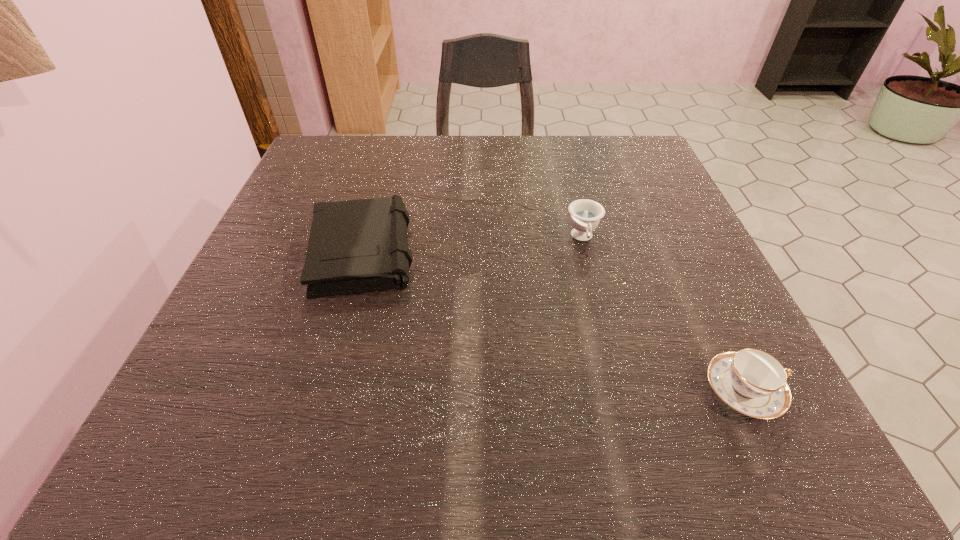
Select which object appears as the second closest to the left teacup. Please provide its 2D coordinates. Your answer should be formatted as a tuple, i.e. [(x, y)], where the tuple contains the x and y coordinates of a point satisfying the conditions above.

[(358, 246)]